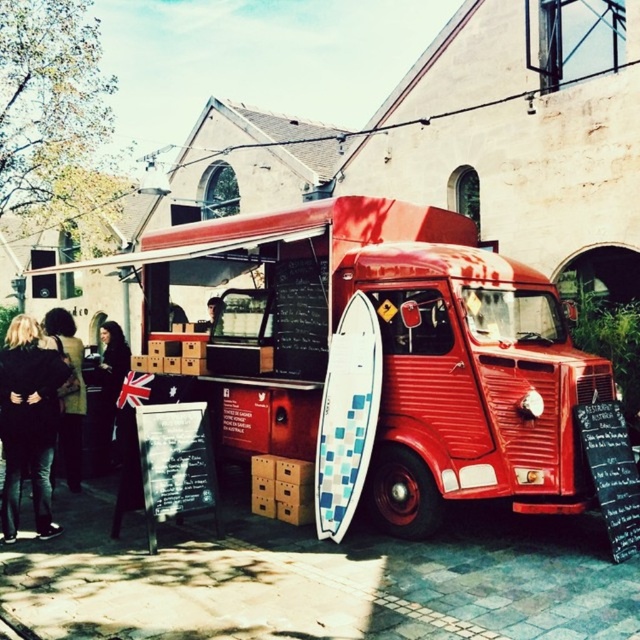
Based on the photo, is white checkered surfboard at center wider than dark brown hair at left?

Indeed, white checkered surfboard at center has a greater width compared to dark brown hair at left.

Does white checkered surfboard at center appear on the right side of dark brown hair at left?

Yes, white checkered surfboard at center is to the right of dark brown hair at left.

Looking at this image, who is more forward, (326,496) or (100,323)?

Point (326,496) is more forward.

The width and height of the screenshot is (640, 640). I want to click on white checkered surfboard at center, so (x=346, y=417).

Is white checkered surfboard at center positioned behind smooth skin face at center?

No.

Does point (358, 426) lie behind point (212, 326)?

No, (358, 426) is closer to viewer.

You are a GUI agent. You are given a task and a screenshot of the screen. Output one action in this format:
    pyautogui.click(x=<x>, y=<y>)
    Task: Click on the white checkered surfboard at center
    
    Given the screenshot: What is the action you would take?
    pyautogui.click(x=346, y=417)

Who is shorter, shiny red van at center or dark brown hair at left?

With less height is dark brown hair at left.

Who is taller, shiny red van at center or dark brown hair at left?

Standing taller between the two is shiny red van at center.

Who is more distant from viewer, (292, 451) or (115, 410)?

The point (115, 410) is more distant.

Locate an element on the screen. shiny red van at center is located at coordinates (378, 355).